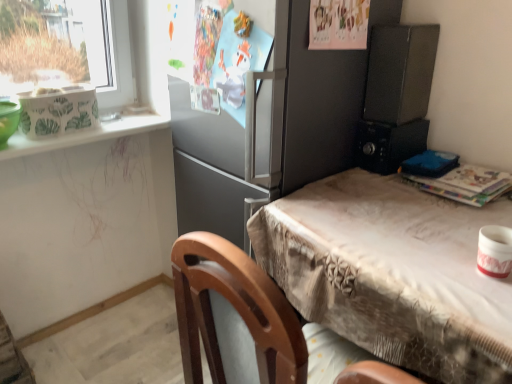
Locate an element on the screen. vacant space situated above white glossy window sill at upper left (from a real-world perspective) is located at coordinates (97, 127).